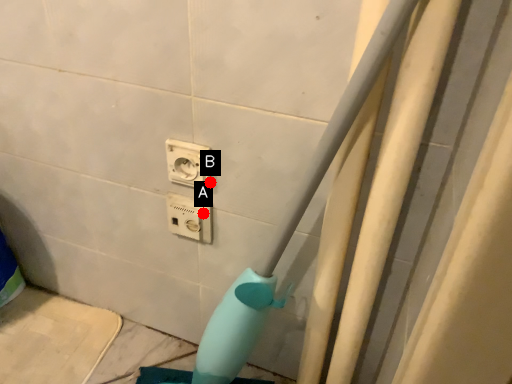
Question: Two points are circled on the image, labeled by A and B beside each circle. Which point appears farthest from the camera in this image?

Choices:
 (A) A is further
 (B) B is further

Answer: (A)